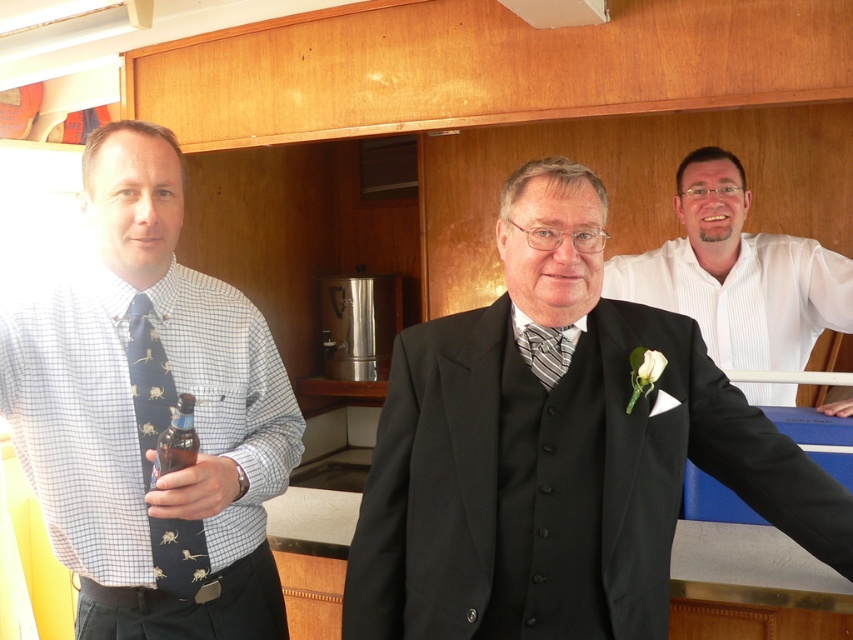
Is white textured shirt at upper right positioned behind striped fabric tie at center?

Yes, it is.

Is white textured shirt at upper right in front of striped fabric tie at center?

That is False.

Find the location of a particular element. The width and height of the screenshot is (853, 640). white textured shirt at upper right is located at coordinates (737, 275).

Is dark blue silk tie at left smaller than striped fabric tie at center?

No.

Which is behind, point (160, 412) or point (524, 333)?

Positioned behind is point (160, 412).

Find the location of a particular element. The width and height of the screenshot is (853, 640). dark blue silk tie at left is located at coordinates (155, 392).

Where is `dark blue silk tie at left`? This screenshot has width=853, height=640. dark blue silk tie at left is located at coordinates (155, 392).

Is blue printed tie at left taller than dark blue silk tie at left?

Indeed, blue printed tie at left has a greater height compared to dark blue silk tie at left.

Can you confirm if blue printed tie at left is positioned below dark blue silk tie at left?

No.

Where is `blue printed tie at left`? The height and width of the screenshot is (640, 853). blue printed tie at left is located at coordinates (149, 413).